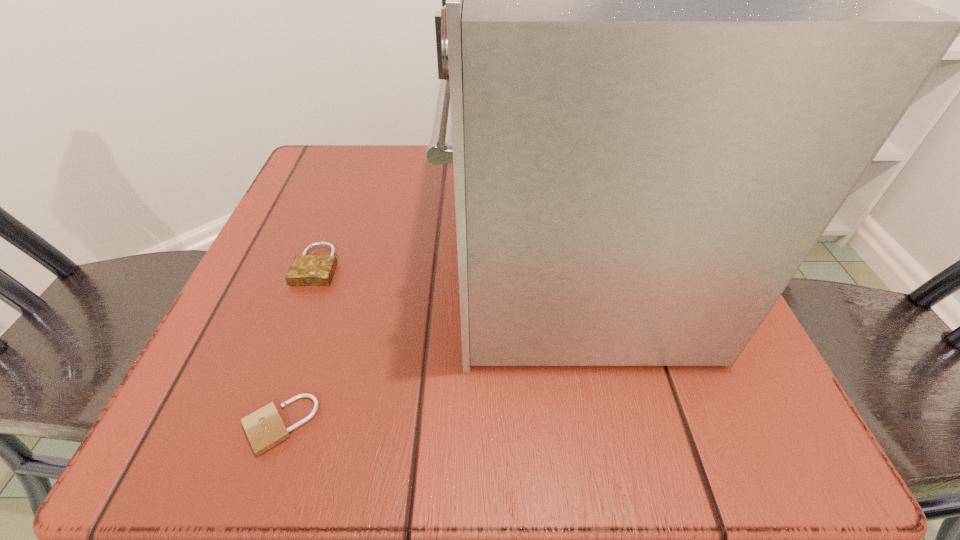
The width and height of the screenshot is (960, 540). Identify the location of the second closest object to the shorter padlock. (306, 270).

Choose which object is the second nearest neighbor to the toaster oven. Please provide its 2D coordinates. Your answer should be formatted as a tuple, i.e. [(x, y)], where the tuple contains the x and y coordinates of a point satisfying the conditions above.

[(306, 270)]

At what (x,y) coordinates should I click in order to perform the action: click on free point that satisfies the following two spatial constraints: 1. on the keyhole side of the shortest object; 2. on the left side of the second tallest object. Please return your answer as a coordinate pair (x, y). Looking at the image, I should click on (257, 424).

Identify the location of vacant area that satisfies the following two spatial constraints: 1. on the front panel of the toaster oven; 2. on the keyhole side of the second shortest object. Image resolution: width=960 pixels, height=540 pixels. (566, 266).

The image size is (960, 540). I want to click on free location that satisfies the following two spatial constraints: 1. on the front panel of the rightmost object; 2. on the keyhole side of the taller padlock, so click(x=566, y=266).

This screenshot has width=960, height=540. I want to click on free space in the image that satisfies the following two spatial constraints: 1. on the keyhole side of the nearest object; 2. on the right side of the farther padlock, so click(257, 424).

I want to click on free space that satisfies the following two spatial constraints: 1. on the front panel of the toaster oven; 2. on the keyhole side of the farther padlock, so click(566, 266).

You are a GUI agent. You are given a task and a screenshot of the screen. Output one action in this format:
    pyautogui.click(x=<x>, y=<y>)
    Task: Click on the free location that satisfies the following two spatial constraints: 1. on the front panel of the rightmost object; 2. on the keyhole side of the taller padlock
    The height and width of the screenshot is (540, 960).
    Given the screenshot: What is the action you would take?
    pyautogui.click(x=566, y=266)

What are the coordinates of `free space that satisfies the following two spatial constraints: 1. on the keyhole side of the second tallest object; 2. on the left side of the shortest object` in the screenshot? It's located at (257, 424).

The image size is (960, 540). In order to click on free spot that satisfies the following two spatial constraints: 1. on the front panel of the tallest object; 2. on the keyhole side of the farther padlock in this screenshot , I will do pyautogui.click(x=566, y=266).